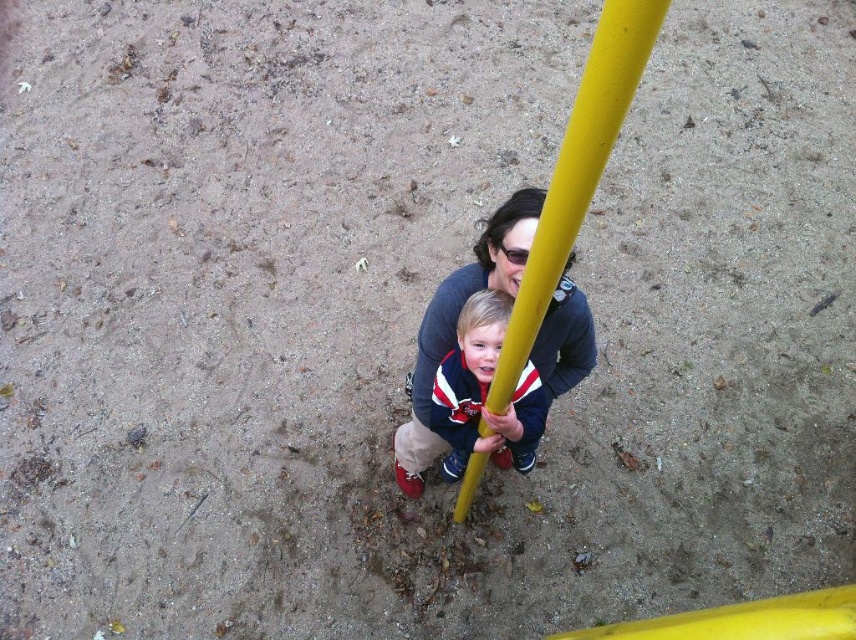
You are a parent with a 3.5 feet tall child. You want to ensure the child can reach the yellow matte pole at center without assistance. Based on the scene, can the child reach the pole?

The yellow matte pole at center is 3.72 feet from viewer. Since the child is 3.5 feet tall, they cannot reach the pole without assistance as it is slightly taller than the child.

You are standing at the playground and want to place a small flag exactly halfway between point (405, 449) and point (484, 333). Which point is closer to the flag when placed halfway?

The point closer to the flag placed halfway between point (405, 449) and point (484, 333) is point (484, 333) because it is closer to the midpoint.

You are designing a playground safety inspection. You need to ensure that the yellow matte pole at center can support the weight of a child wearing the matte blue sweater at center. Based on the pole and sweater dimensions, is the pole thick enough to safely hold the child?

The yellow matte pole at center is thinner than the matte blue sweater at center. Since the pole is thinner than the sweater, it may not have sufficient structural strength to safely support the child. A thicker pole should be installed for safety.